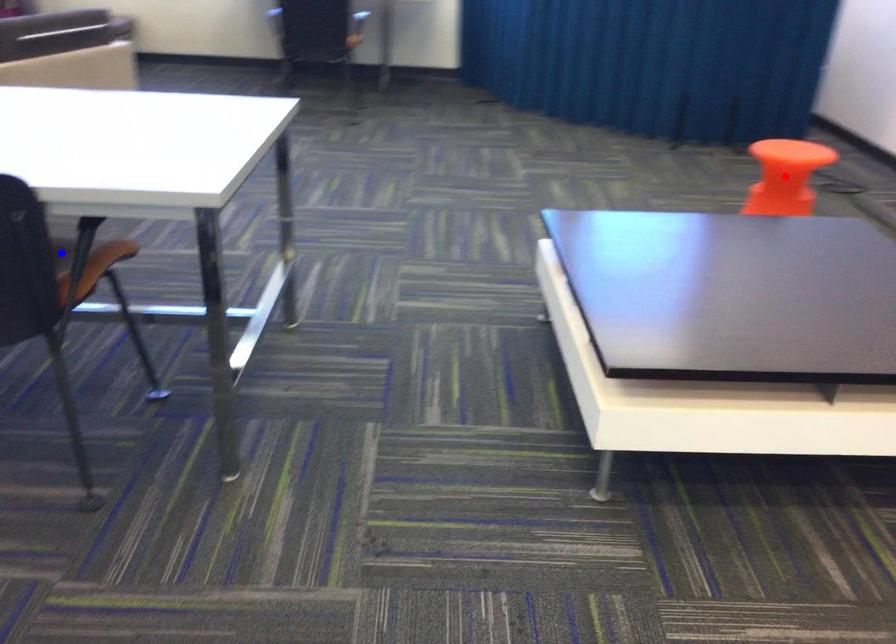
Question: Two points are marked on the image. Which point is closer to the camera?

Choices:
 (A) Blue point is closer.
 (B) Red point is closer.

Answer: (A)